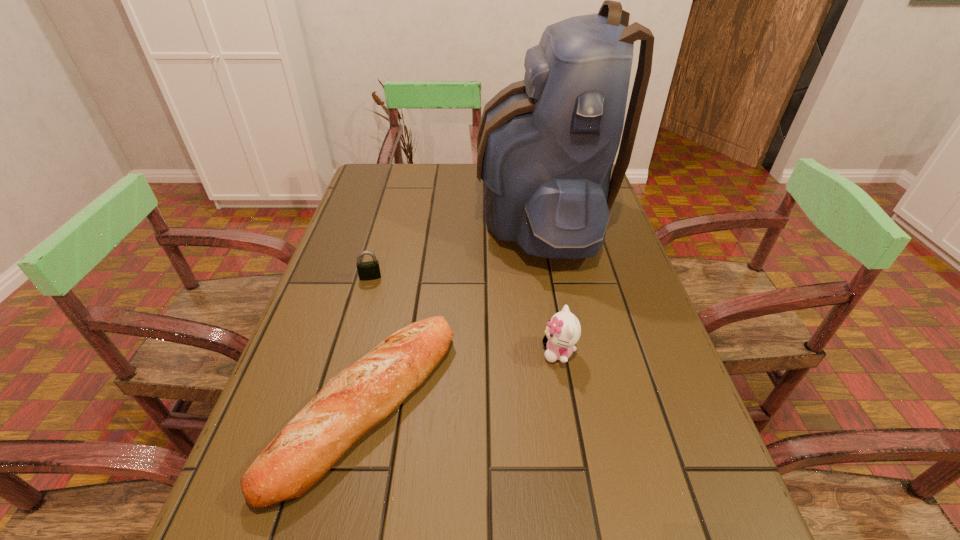
At what (x,y) coordinates should I click in order to perform the action: click on vacant region at the far left corner of the desktop. Please return your answer as a coordinate pair (x, y). Looking at the image, I should click on (389, 164).

Find the location of a particular element. vacant space that's between the baguet and the padlock is located at coordinates (369, 341).

The width and height of the screenshot is (960, 540). I want to click on free space between the kitten and the tallest object, so 549,284.

Where is `unoccupied area between the baguet and the backpack`? unoccupied area between the baguet and the backpack is located at coordinates (453, 310).

Identify the location of object that is the closest one to the backpack. Image resolution: width=960 pixels, height=540 pixels. (353, 402).

Select which object appears as the closest to the padlock. Please provide its 2D coordinates. Your answer should be formatted as a tuple, i.e. [(x, y)], where the tuple contains the x and y coordinates of a point satisfying the conditions above.

[(353, 402)]

Locate an element on the screen. The height and width of the screenshot is (540, 960). vacant region that satisfies the following two spatial constraints: 1. on the front-facing side of the kitten; 2. on the front side of the baguet is located at coordinates (568, 404).